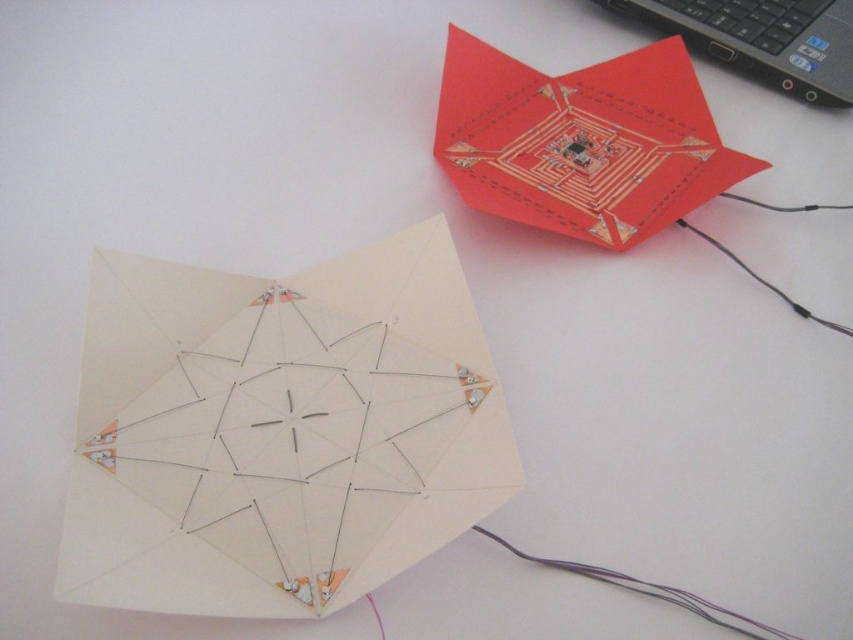
Question: Which object appears farthest from the camera in this image?

Choices:
 (A) black rubber wire at upper right
 (B) purple wire at lower right

Answer: (A)

Question: Which point appears closest to the camera in this image?

Choices:
 (A) (846, 44)
 (B) (759, 204)

Answer: (B)

Question: Can you confirm if white matte paper at center is positioned below black rubber wire at upper right?

Choices:
 (A) yes
 (B) no

Answer: (A)

Question: Considering the relative positions of black plastic laptop at upper right and black rubber wire at upper right in the image provided, where is black plastic laptop at upper right located with respect to black rubber wire at upper right?

Choices:
 (A) below
 (B) above

Answer: (B)

Question: Does white matte paper at center appear over black rubber wire at upper right?

Choices:
 (A) yes
 (B) no

Answer: (B)

Question: Among these objects, which one is nearest to the camera?

Choices:
 (A) white matte paper at center
 (B) black rubber wire at upper right

Answer: (A)